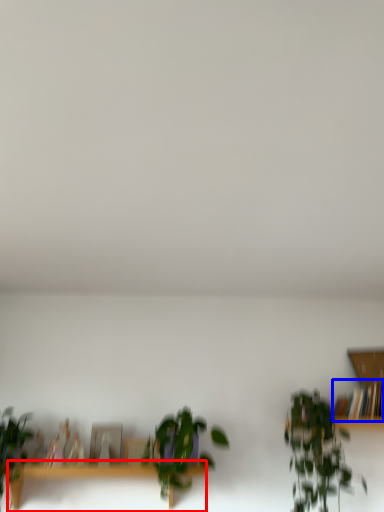
Question: Which object appears farthest to the camera in this image, table (highlighted by a red box) or book (highlighted by a blue box)?

Choices:
 (A) table
 (B) book

Answer: (B)